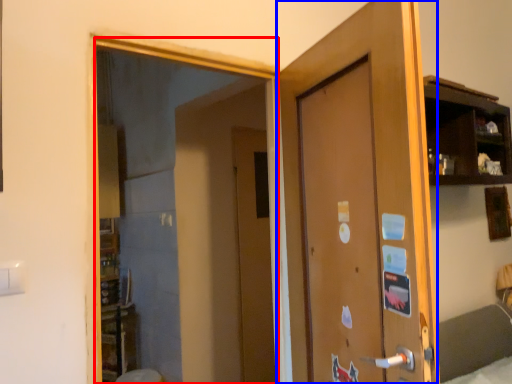
Question: Which object appears farthest to the camera in this image, mirror (highlighted by a red box) or door (highlighted by a blue box)?

Choices:
 (A) mirror
 (B) door

Answer: (A)